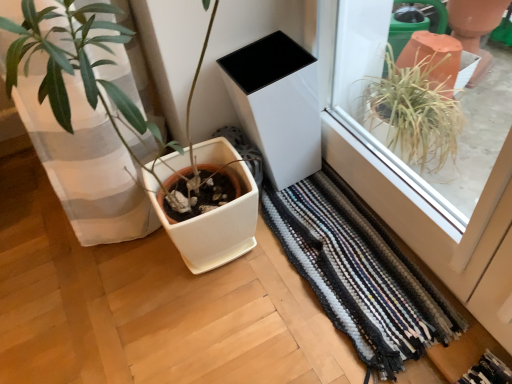
This screenshot has height=384, width=512. What are the coordinates of `multicolored woven mat at lower right` in the screenshot? It's located at pos(359,272).

Describe the element at coordinates (359, 272) in the screenshot. I see `multicolored woven mat at lower right` at that location.

Locate an element on the screen. The image size is (512, 384). multicolored woven mat at lower right is located at coordinates (359, 272).